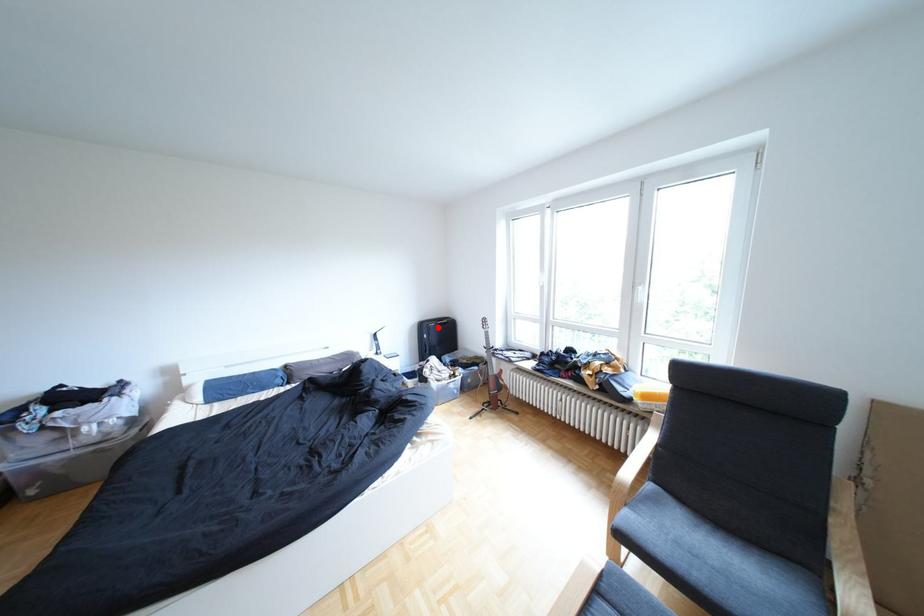
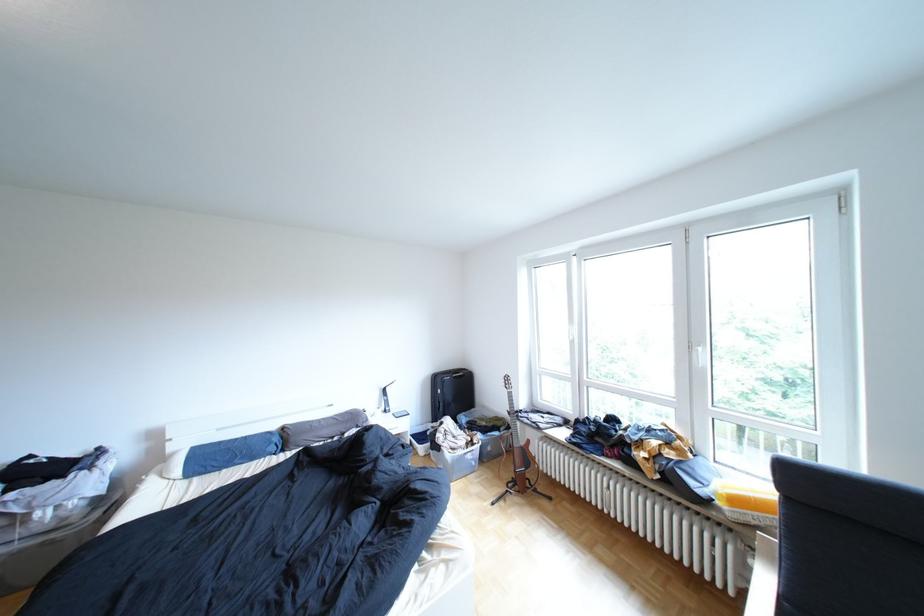
In the second image, find the point that corresponds to the highlighted location in the first image.

(452, 379)